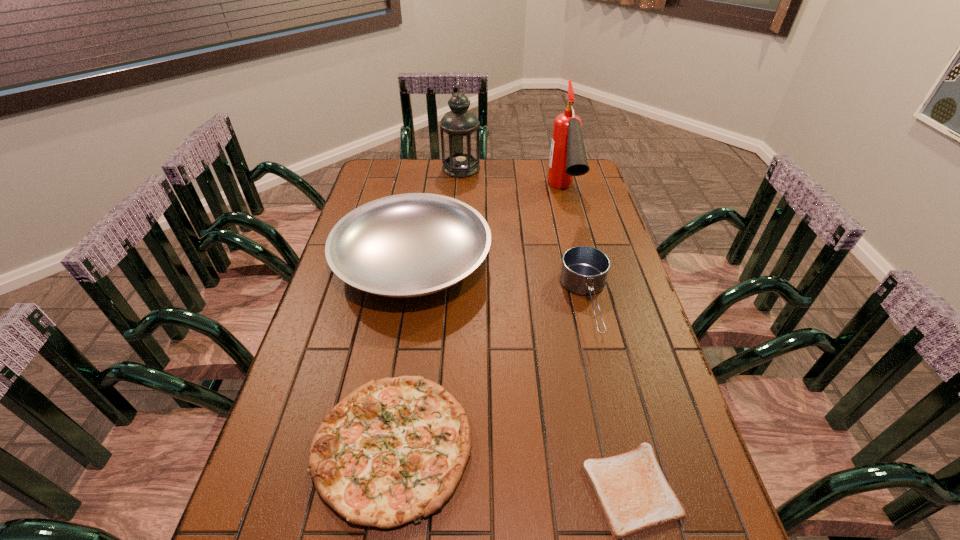
This screenshot has height=540, width=960. What are the coordinates of `empty space that is in between the fourth shortest object and the shortest object` in the screenshot? It's located at (522, 375).

Find the location of `vacant space that's between the saucepan and the bedpan`. vacant space that's between the saucepan and the bedpan is located at coordinates (500, 282).

Identify which object is located as the second nearest to the saucepan. Please provide its 2D coordinates. Your answer should be formatted as a tuple, i.e. [(x, y)], where the tuple contains the x and y coordinates of a point satisfying the conditions above.

[(568, 158)]

Where is `the fourth closest object relative to the fourth shortest object`? This screenshot has width=960, height=540. the fourth closest object relative to the fourth shortest object is located at coordinates (460, 133).

This screenshot has height=540, width=960. I want to click on vacant region that satisfies the following two spatial constraints: 1. on the front side of the shortest object; 2. on the left side of the pizza, so 387,489.